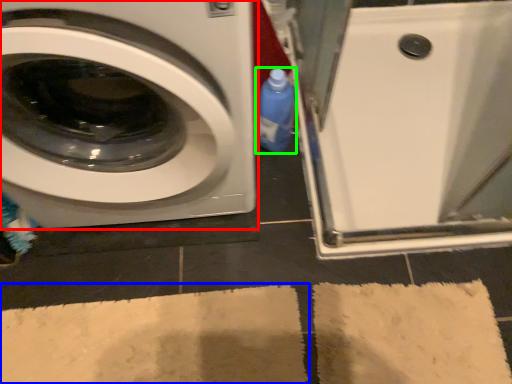
Question: Considering the real-world distances, which object is closest to washing machine (highlighted by a red box)? bath mat (highlighted by a blue box) or cleaning product (highlighted by a green box).

Choices:
 (A) bath mat
 (B) cleaning product

Answer: (B)